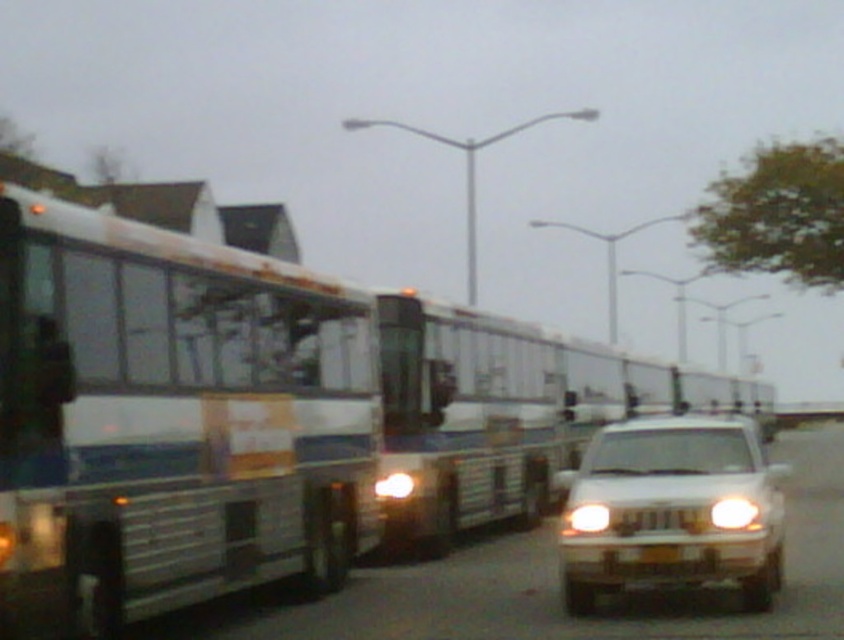
Question: Does white glossy suv at lower right appear on the left side of white plastic headlight at center?

Choices:
 (A) yes
 (B) no

Answer: (B)

Question: Estimate the real-world distances between objects in this image. Which object is farther from the white glossy bus at center?

Choices:
 (A) white glossy headlight at center
 (B) white glossy bus at left
 (C) white glossy suv at lower right

Answer: (B)

Question: Considering the real-world distances, which object is closest to the white plastic headlight at center?

Choices:
 (A) white glossy bus at left
 (B) white glossy headlight at center
 (C) white glossy suv at lower right

Answer: (B)

Question: Among these points, which one is farthest from the camera?

Choices:
 (A) (753, 522)
 (B) (601, 508)
 (C) (139, 468)

Answer: (B)

Question: Does white glossy bus at left appear on the right side of white glossy suv at lower right?

Choices:
 (A) no
 (B) yes

Answer: (A)

Question: Does white glossy bus at left have a larger size compared to white glossy bus at center?

Choices:
 (A) yes
 (B) no

Answer: (B)